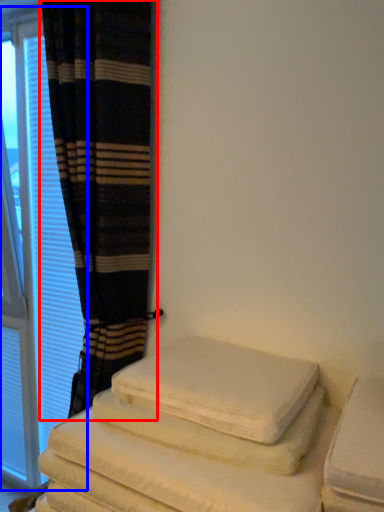
Question: Which object is closer to the camera taking this photo, curtain (highlighted by a red box) or window (highlighted by a blue box)?

Choices:
 (A) curtain
 (B) window

Answer: (A)